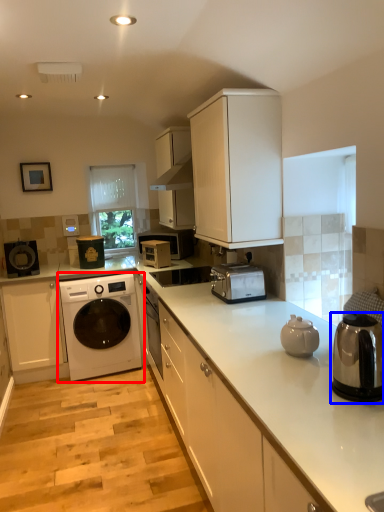
Question: Which object appears closest to the camera in this image, washing machine (highlighted by a red box) or home appliance (highlighted by a blue box)?

Choices:
 (A) washing machine
 (B) home appliance

Answer: (B)